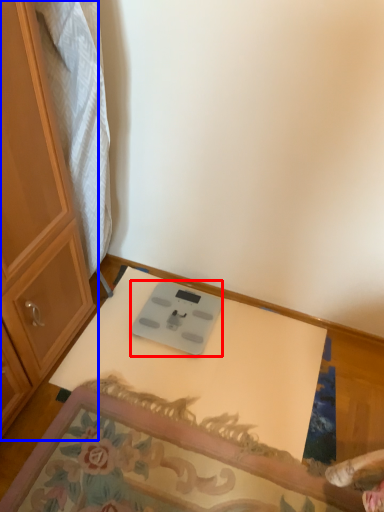
Question: Among these objects, which one is farthest to the camera, weight scale (highlighted by a red box) or cabinetry (highlighted by a blue box)?

Choices:
 (A) weight scale
 (B) cabinetry

Answer: (A)